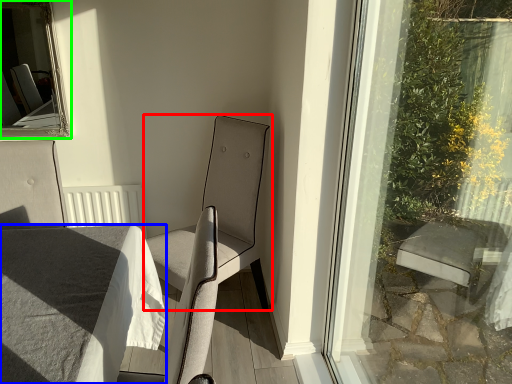
Question: Considering the real-world distances, which object is farthest from chair (highlighted by a red box)? table (highlighted by a blue box) or bay window (highlighted by a green box)?

Choices:
 (A) table
 (B) bay window

Answer: (B)